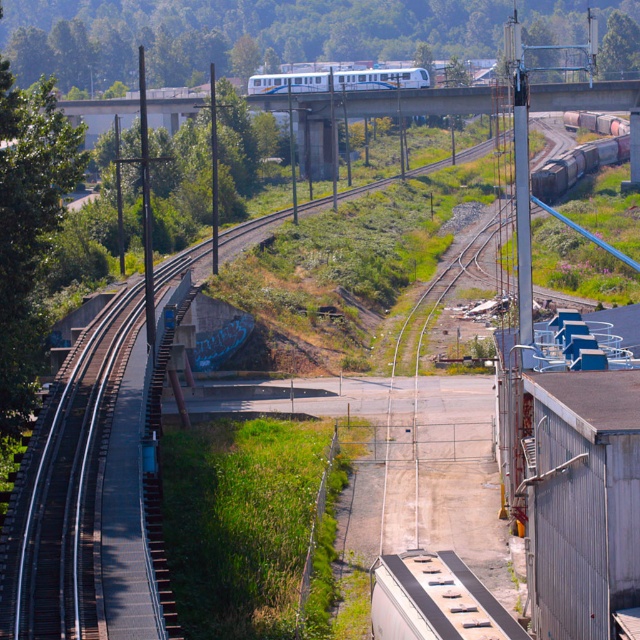
You are standing at the center of the railway tracks in the image. You want to locate the rusty metal train car at right. In which direction should you look?

You should look to the right to locate the rusty metal train car at right since it is positioned at the right side of the image.

You are a photographer planning to capture both the rusty metal train car at right and the white glossy passenger train at upper center in a single shot. Which train should you position closer to the camera to ensure both are visible in the frame?

You should position the rusty metal train car at right closer to the camera because it is bigger than the white glossy passenger train at upper center, so placing it nearer will help balance their sizes in the photo.

You are a photographer standing at the railway tracks in the foreground. You want to take a photo of both the rusty metal train car at right and the white glossy passenger train at upper center. Which train should you focus on first to ensure it appears sharp in your photo?

You should focus on the rusty metal train car at right first because it is closer to the viewer than the white glossy passenger train at upper center. Since it is nearer, it requires proper focusing before the background elements.